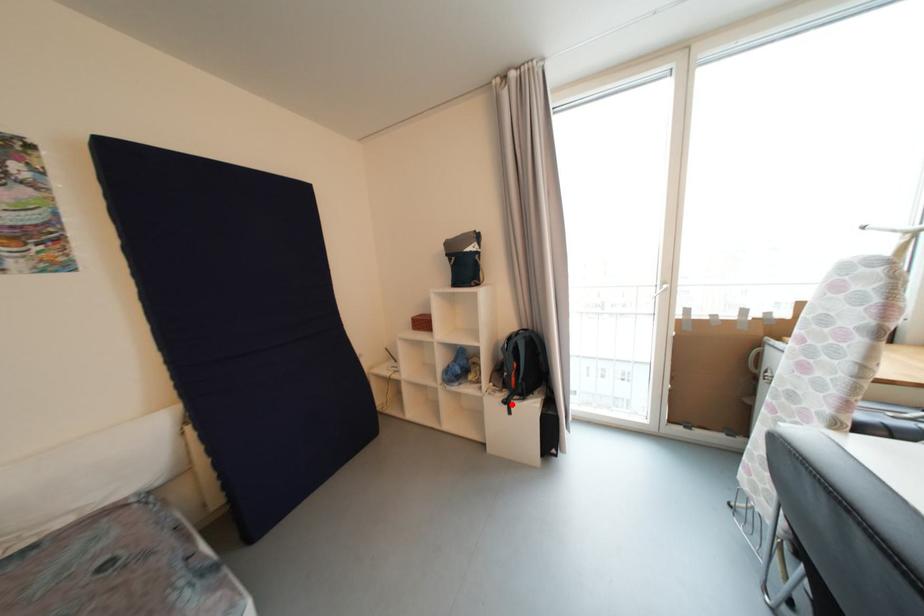
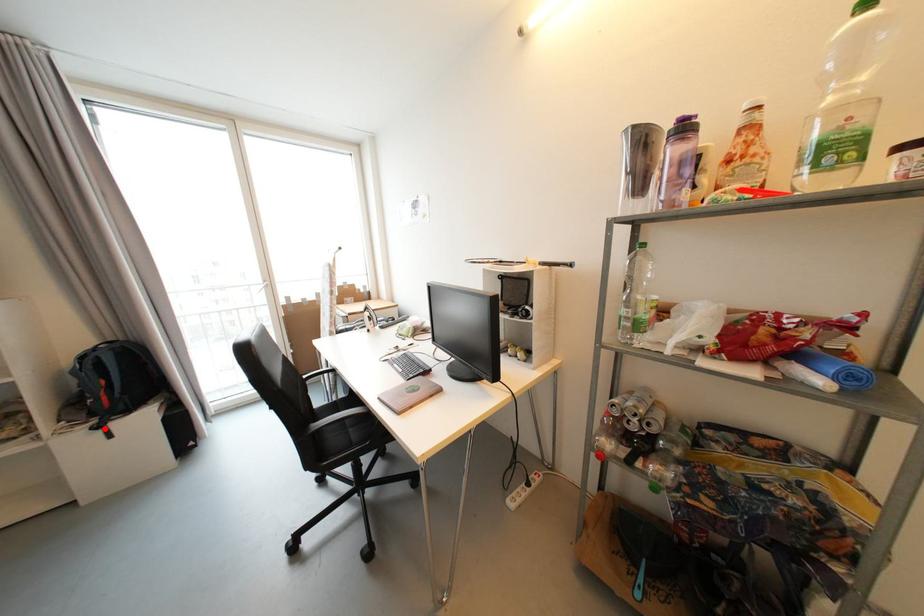
Consider the image. I am providing you with two images of the same scene from different viewpoints. A red point is marked on the first image and another point is marked on the second image. Are the points marked in image1 and image2 representing the same 3D position?

Yes